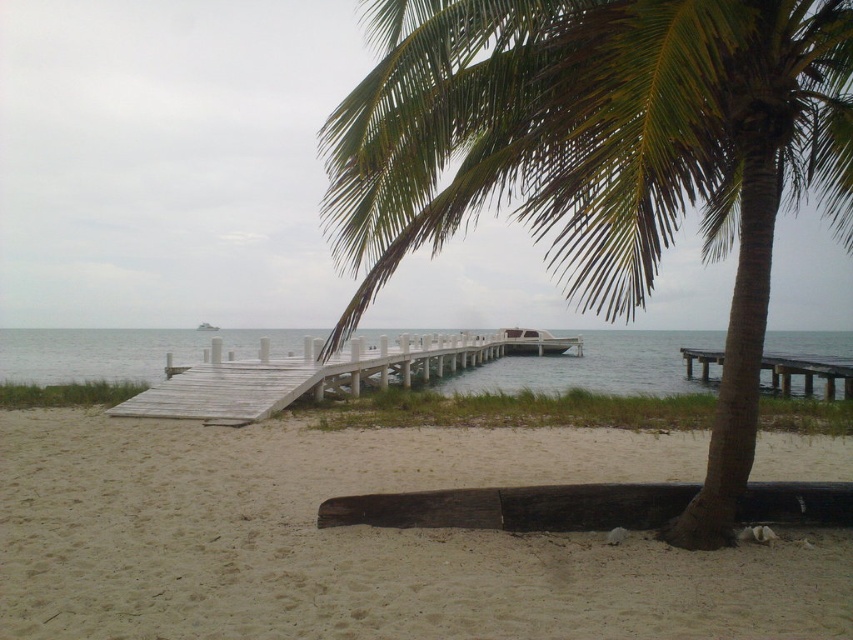
What is the relationship between the widths of the green leafy palm tree at center and the white wooden dock at center in the beach scene?

The green leafy palm tree at center has a lesser width compared to the white wooden dock at center.

You are a photographer planning to take a photo of the clear blue water at center and the wooden dock at right. Based on their sizes in the image, which one would appear larger in the frame?

The clear blue water at center appears larger in the frame because it is much taller than the wooden dock at right.

You are standing at the center of the image and want to walk to the sandy beach at lower left. Which direction should you move in to reach it?

You should move to the lower left direction to reach the sandy beach at lower left since it is located at point (364, 540).